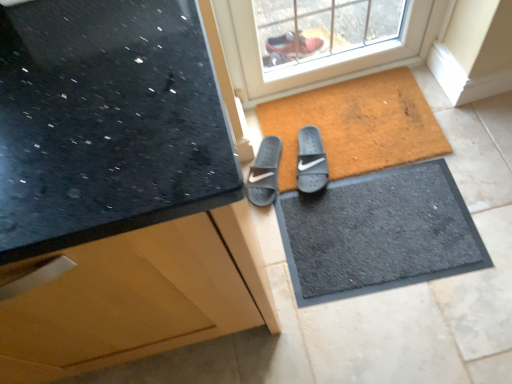
Identify the location of spots to the right of gray rubber slide at center, which ranks as the 2th footwear in left-to-right order. This screenshot has height=384, width=512. (352, 142).